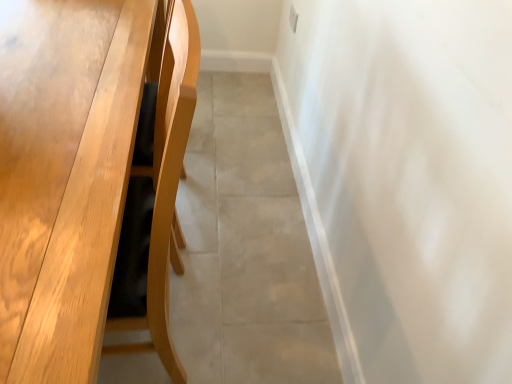
Locate an element on the screen. The height and width of the screenshot is (384, 512). free location above beige tile floor at center (from a real-world perspective) is located at coordinates (257, 198).